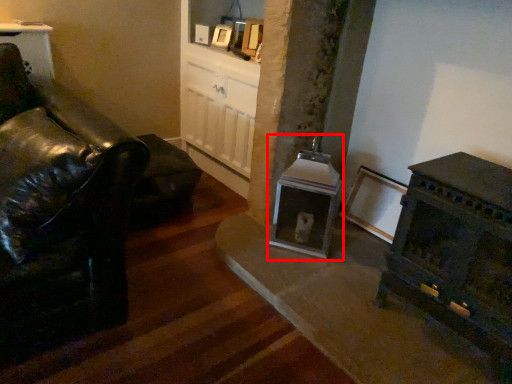
Question: From the image, what is the correct spatial relationship of fireplace (annotated by the red box) in relation to picture frame?

Choices:
 (A) right
 (B) left

Answer: (A)